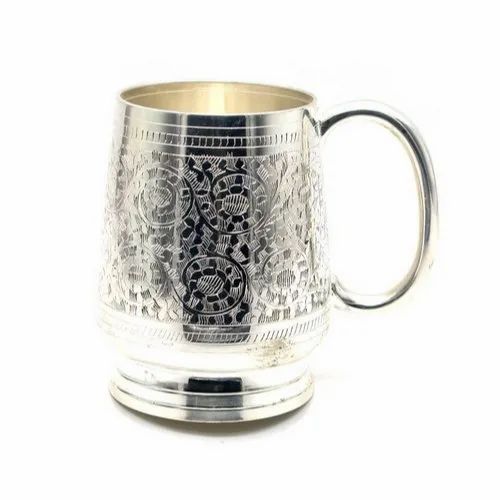
What are the coordinates of `polished interior` in the screenshot? It's located at (220, 102).